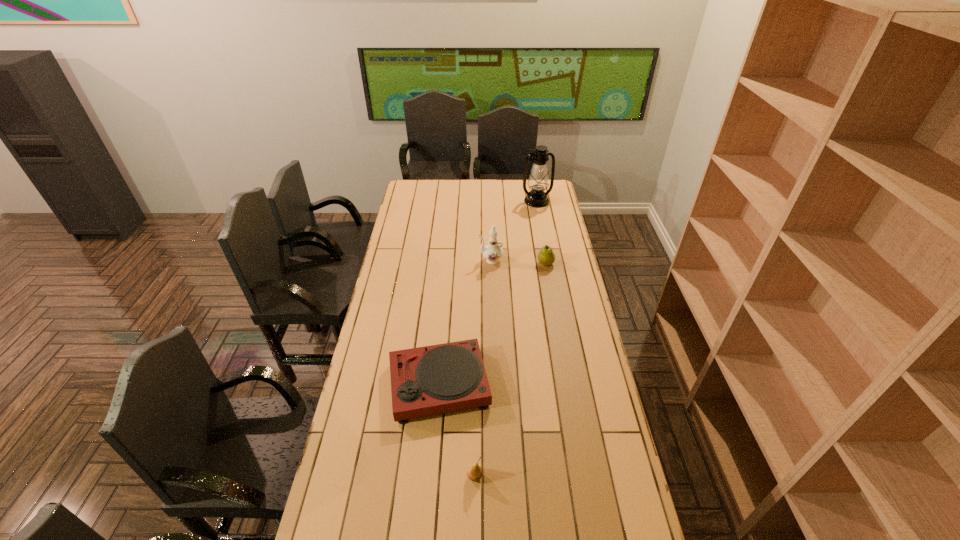
Identify the location of the tallest object. The height and width of the screenshot is (540, 960). (538, 181).

The image size is (960, 540). What are the coordinates of `oil lamp` in the screenshot? It's located at (538, 181).

Find the location of a particular element. the fourth shortest object is located at coordinates (493, 252).

Where is `the right pear`? the right pear is located at coordinates (546, 256).

You are a GUI agent. You are given a task and a screenshot of the screen. Output one action in this format:
    pyautogui.click(x=<x>, y=<y>)
    Task: Click on the farther pear
    
    Given the screenshot: What is the action you would take?
    pyautogui.click(x=546, y=256)

Image resolution: width=960 pixels, height=540 pixels. What are the coordinates of `the shorter pear` in the screenshot? It's located at (474, 473).

Identify the location of the left pear. (474, 473).

You are a GUI agent. You are given a task and a screenshot of the screen. Output one action in this format:
    pyautogui.click(x=<x>, y=<y>)
    Task: Click on the fourth farthest object
    The width and height of the screenshot is (960, 540).
    Given the screenshot: What is the action you would take?
    pyautogui.click(x=442, y=378)

Where is `vacant region located 0.170m on the back of the farthest object`? Image resolution: width=960 pixels, height=540 pixels. vacant region located 0.170m on the back of the farthest object is located at coordinates (533, 181).

This screenshot has height=540, width=960. I want to click on free space located at the spout of the chinaware, so click(x=399, y=260).